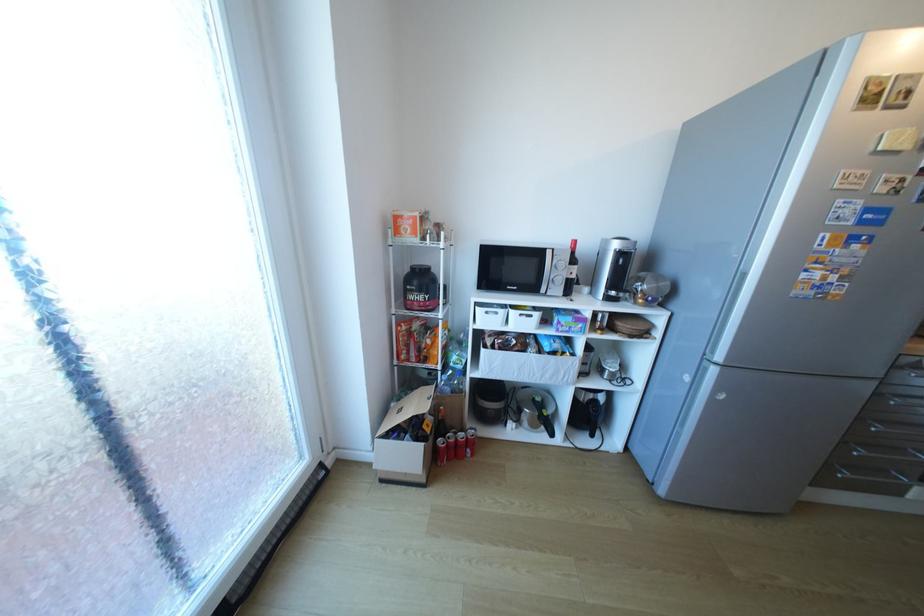
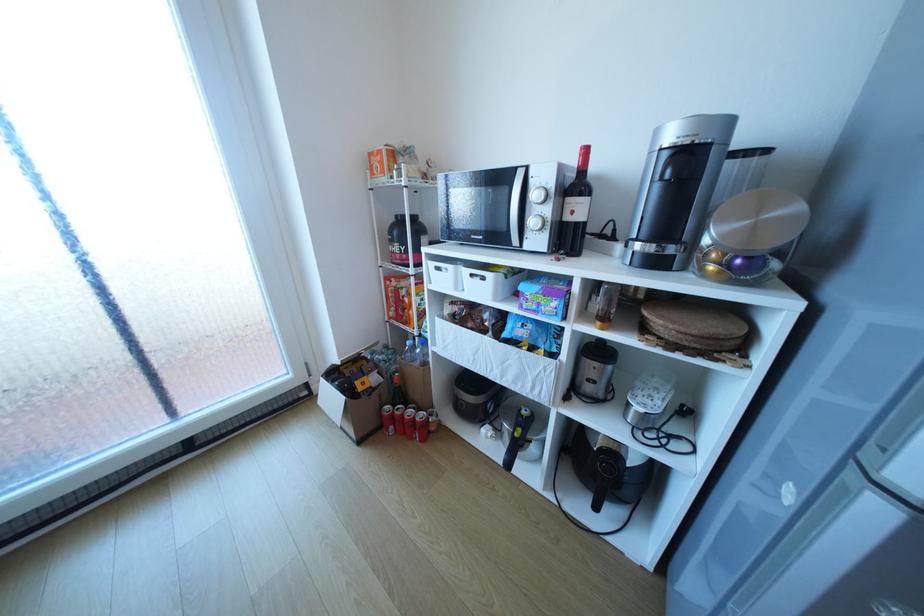
In the second image, find the point that corresponds to pixel 495 313 in the first image.

(446, 268)